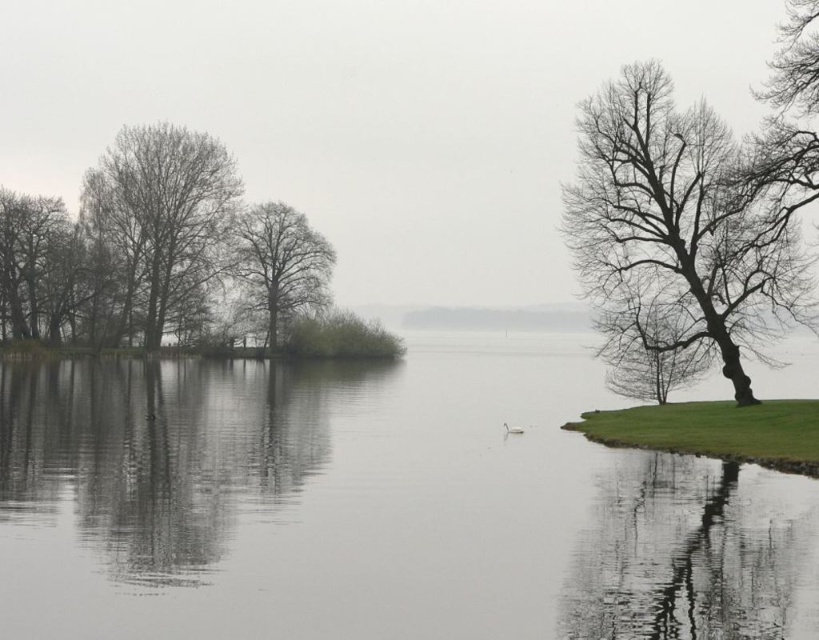
You are a bird looking for a place to perch. You see the bare wood trees at left and the bare wood tree at center. Which tree is closer to the grassy area on the right side?

The bare wood trees at left are closer to the grassy area on the right side because they are only 5.34 meters away from the bare wood tree at center, but the exact distance to the grassy area isn

You are an observer standing on the lakeside. You see the bare wood trees at left and the brown textured tree at left. Which one is taller?

The bare wood trees at left is taller than the brown textured tree at left according to the description provided.